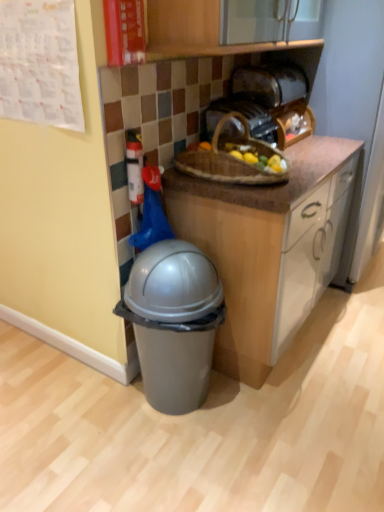
Question: Considering the positions of white plastic fire extinguisher at upper left and brown woven picnic basket at center in the image, is white plastic fire extinguisher at upper left taller or shorter than brown woven picnic basket at center?

Choices:
 (A) tall
 (B) short

Answer: (A)

Question: Does point (137, 183) appear closer or farther from the camera than point (256, 141)?

Choices:
 (A) closer
 (B) farther

Answer: (A)

Question: Which of these objects is positioned farthest from the brown woven picnic basket at center?

Choices:
 (A) white plastic fire extinguisher at upper left
 (B) satin gold toaster at upper center, the second toaster ordered from the bottom
 (C) gray plastic trash can at lower left
 (D) wooden basket at upper center, arranged as the 1th toaster when ordered from the bottom

Answer: (C)

Question: Which of these objects is positioned closest to the gray plastic trash can at lower left?

Choices:
 (A) satin gold toaster at upper center, placed as the first toaster when sorted from top to bottom
 (B) wooden basket at upper center, arranged as the 1th toaster when ordered from the bottom
 (C) white plastic fire extinguisher at upper left
 (D) brown woven picnic basket at center

Answer: (C)